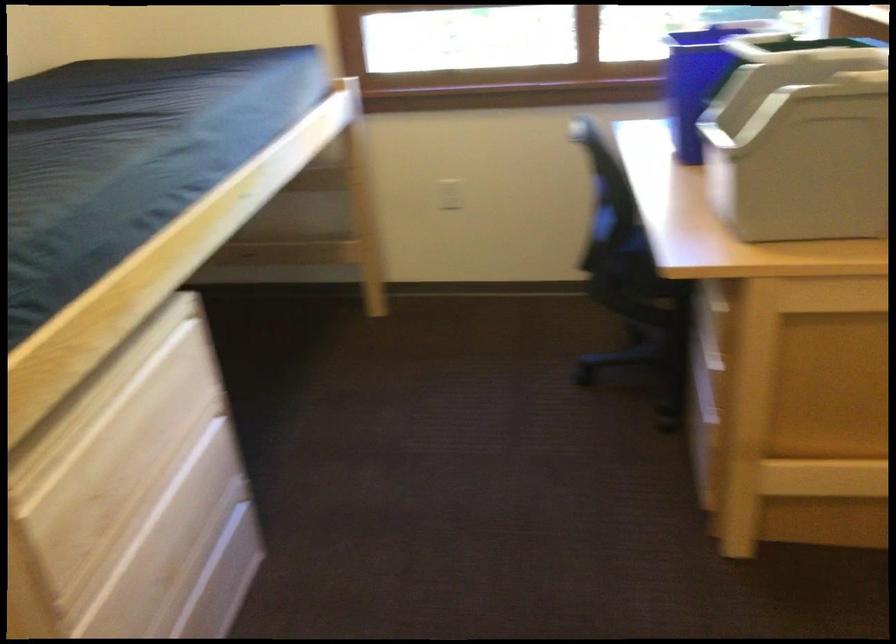
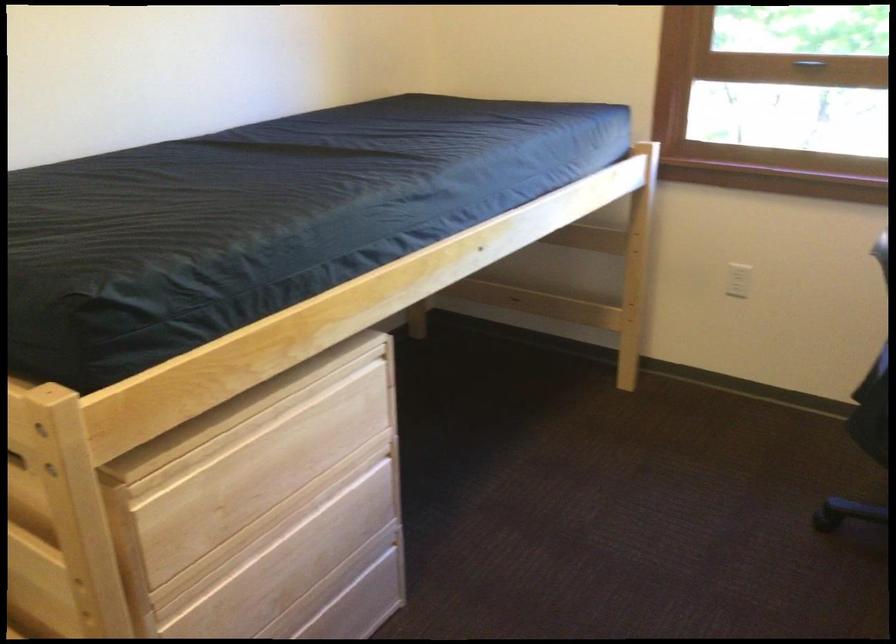
Locate, in the second image, the point that corresponds to the point at 135,420 in the first image.

(285, 448)